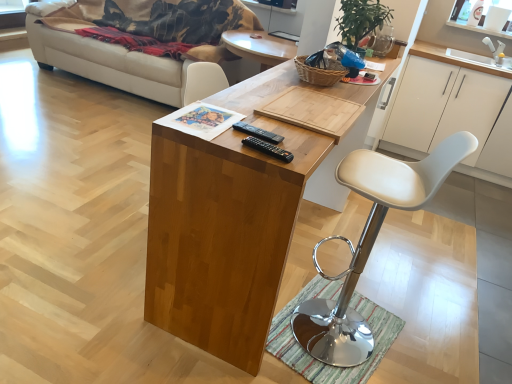
The image size is (512, 384). Identify the location of free spot in front of black plastic remote at center, placed as the first remote when sorted from back to front. (254, 149).